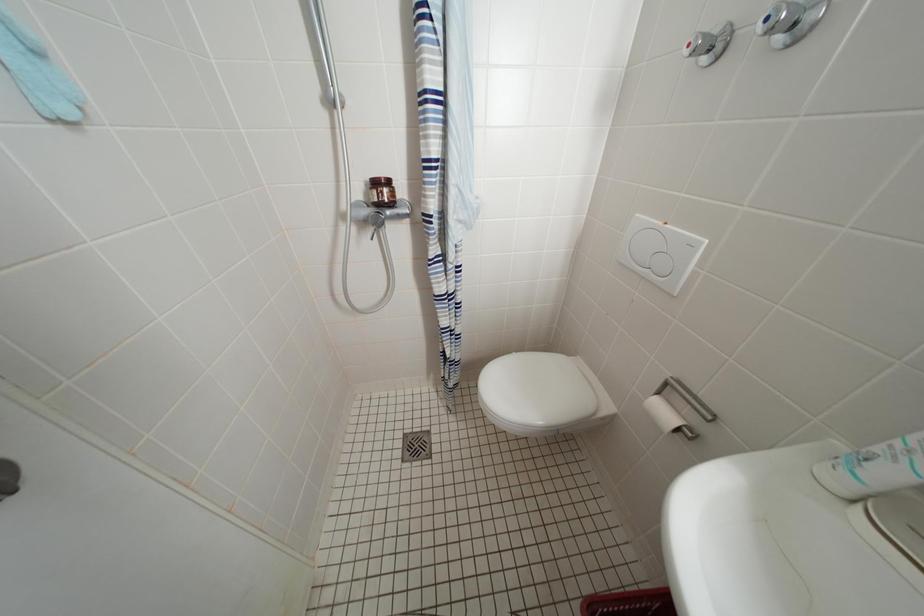
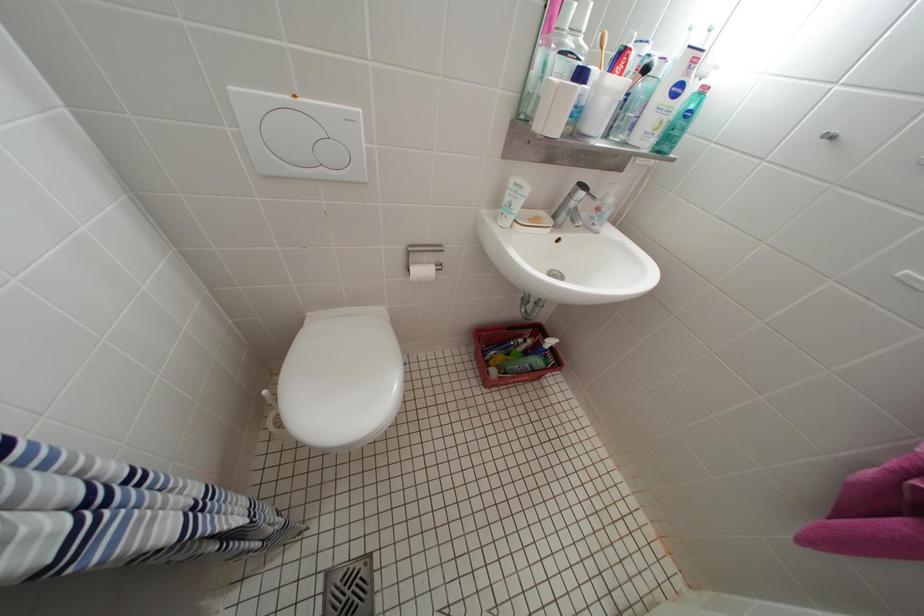
The images are taken continuously from a first-person perspective. In which direction is your viewpoint rotating?

The rotation direction of the camera is right-down.